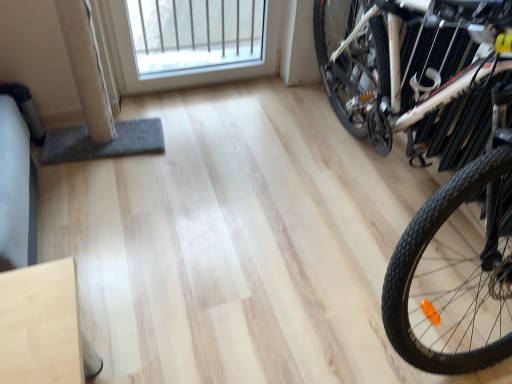
Locate an element on the screen. This screenshot has width=512, height=384. vacant space positioned to the left of white matte bicycle at right is located at coordinates tap(184, 205).